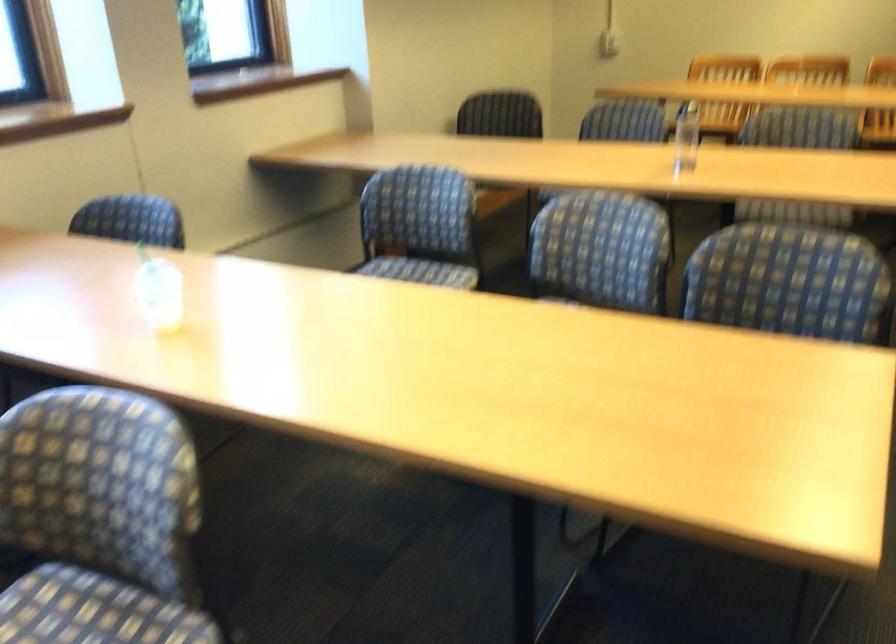
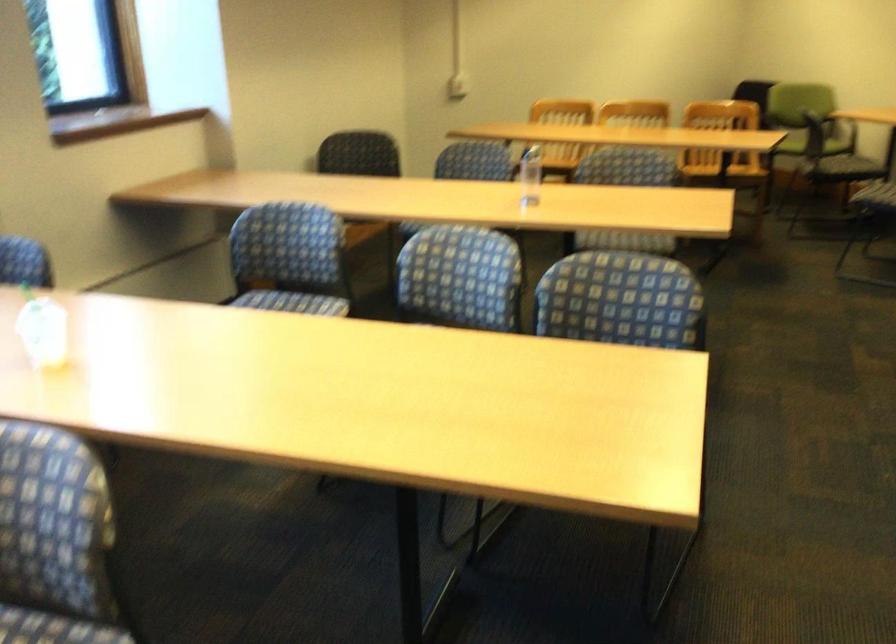
Find the pixel in the second image that matches [786,283] in the first image.

(622, 301)